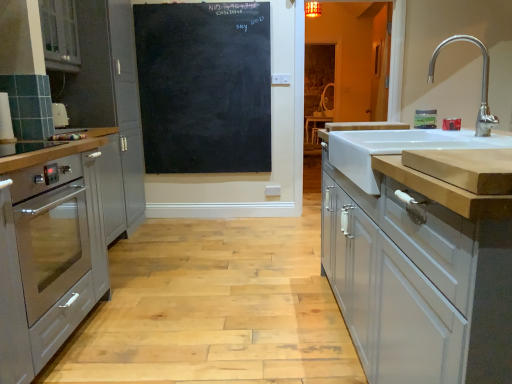
At what (x,y) coordinates should I click in order to perform the action: click on satin silver oven at left, the second cabinetry in the left-to-right sequence. Please return your answer as a coordinate pair (x, y). Looking at the image, I should click on (109, 104).

Is white glossy cabinet at right, positioned as the fourth cabinetry in left-to-right order, placed right next to white ceramic sink at right?

white glossy cabinet at right, positioned as the fourth cabinetry in left-to-right order, and white ceramic sink at right are clearly separated.

Consider the image. How much distance is there between white glossy cabinet at right, the 1th cabinetry viewed from the right, and white ceramic sink at right?

The distance of white glossy cabinet at right, the 1th cabinetry viewed from the right, from white ceramic sink at right is 23.52 centimeters.

Between white glossy cabinet at right, positioned as the fourth cabinetry in left-to-right order, and white ceramic sink at right, which one has smaller size?

Smaller between the two is white ceramic sink at right.

Is white glossy cabinet at right, the 1th cabinetry viewed from the right, situated inside white ceramic sink at right or outside?

white glossy cabinet at right, the 1th cabinetry viewed from the right, is spatially situated outside white ceramic sink at right.

Does white glossy cabinet at right, the 1th cabinetry viewed from the right, have a greater height compared to stainless steel oven at left?

Indeed, white glossy cabinet at right, the 1th cabinetry viewed from the right, has a greater height compared to stainless steel oven at left.

Could you measure the distance between white glossy cabinet at right, positioned as the fourth cabinetry in left-to-right order, and stainless steel oven at left?

They are 1.30 meters apart.

From a real-world perspective, is white glossy cabinet at right, the 1th cabinetry viewed from the right, positioned above or below stainless steel oven at left?

In terms of real-world spatial position, white glossy cabinet at right, the 1th cabinetry viewed from the right, is below stainless steel oven at left.

This screenshot has height=384, width=512. I want to click on the 1st cabinetry located beneath the stainless steel oven at left (from a real-world perspective), so click(417, 260).

From a real-world perspective, does satin silver oven at left, placed as the second cabinetry when sorted from right to left, stand above stainless steel oven at left?

Incorrect, from a real-world perspective, satin silver oven at left, placed as the second cabinetry when sorted from right to left, is lower than stainless steel oven at left.

Is satin silver oven at left, placed as the second cabinetry when sorted from right to left, to the right of stainless steel oven at left from the viewer's perspective?

In fact, satin silver oven at left, placed as the second cabinetry when sorted from right to left, is to the left of stainless steel oven at left.

Is satin silver oven at left, which is the third cabinetry in left-to-right order, inside or outside of stainless steel oven at left?

satin silver oven at left, which is the third cabinetry in left-to-right order, exists outside the volume of stainless steel oven at left.

Is green matte jar at upper right in contact with satin silver oven at left, which is the third cabinetry in left-to-right order?

green matte jar at upper right and satin silver oven at left, which is the third cabinetry in left-to-right order, are not in contact.

Locate an element on the screen. appliance that appears above the satin silver oven at left, which is the third cabinetry in left-to-right order (from the image's perspective) is located at coordinates (425, 119).

How many degrees apart are the facing directions of green matte jar at upper right and satin silver oven at left, placed as the second cabinetry when sorted from right to left?

The facing directions of green matte jar at upper right and satin silver oven at left, placed as the second cabinetry when sorted from right to left, are 0.805 degrees apart.

Which object is thinner, green matte jar at upper right or satin silver oven at left, which is the third cabinetry in left-to-right order?

green matte jar at upper right is thinner.

Considering the points (81, 91) and (138, 144), which point is behind, point (81, 91) or point (138, 144)?

The point (138, 144) is farther from the camera.

How different are the orientations of satin silver oven at left, the second cabinetry in the left-to-right sequence, and satin silver oven at left, placed as the second cabinetry when sorted from right to left, in degrees?

satin silver oven at left, the second cabinetry in the left-to-right sequence, and satin silver oven at left, placed as the second cabinetry when sorted from right to left, are facing 0.941 degrees away from each other.

Is satin silver oven at left, arranged as the 3th cabinetry when viewed from the right, not near satin silver oven at left, which is the third cabinetry in left-to-right order?

No.

From a real-world perspective, which object rests below the other?

satin silver oven at left, placed as the second cabinetry when sorted from right to left.

Is point (356, 283) closer to viewer compared to point (131, 209)?

Yes.

Is white glossy cabinet at right, the 1th cabinetry viewed from the right, oriented towards satin silver oven at left, arranged as the 3th cabinetry when viewed from the right?

No, white glossy cabinet at right, the 1th cabinetry viewed from the right, does not turn towards satin silver oven at left, arranged as the 3th cabinetry when viewed from the right.

How far apart are white glossy cabinet at right, the 1th cabinetry viewed from the right, and satin silver oven at left, the second cabinetry in the left-to-right sequence?

white glossy cabinet at right, the 1th cabinetry viewed from the right, and satin silver oven at left, the second cabinetry in the left-to-right sequence, are 6.73 feet apart.

Based on their sizes in the image, would you say white glossy cabinet at right, the 1th cabinetry viewed from the right, is bigger or smaller than satin silver oven at left, the second cabinetry in the left-to-right sequence?

white glossy cabinet at right, the 1th cabinetry viewed from the right, is bigger than satin silver oven at left, the second cabinetry in the left-to-right sequence.

From a real-world perspective, is satin silver oven at left, which is the third cabinetry in left-to-right order, positioned over satin silver oven at left, the second cabinetry in the left-to-right sequence, based on gravity?

No, from a real-world perspective, satin silver oven at left, which is the third cabinetry in left-to-right order, is not above satin silver oven at left, the second cabinetry in the left-to-right sequence.

Is satin silver oven at left, placed as the second cabinetry when sorted from right to left, with satin silver oven at left, arranged as the 3th cabinetry when viewed from the right?

Indeed, satin silver oven at left, placed as the second cabinetry when sorted from right to left, and satin silver oven at left, arranged as the 3th cabinetry when viewed from the right, are beside each other and touching.

From the image's perspective, between satin silver oven at left, placed as the second cabinetry when sorted from right to left, and satin silver oven at left, the second cabinetry in the left-to-right sequence, who is located below?

satin silver oven at left, placed as the second cabinetry when sorted from right to left.

Looking at this image, is satin silver oven at left, which is the third cabinetry in left-to-right order, spatially inside satin silver oven at left, arranged as the 3th cabinetry when viewed from the right, or outside of it?

satin silver oven at left, which is the third cabinetry in left-to-right order, is not inside satin silver oven at left, arranged as the 3th cabinetry when viewed from the right, it's outside.

Locate an element on the screen. This screenshot has height=384, width=512. cabinetry that is the 2nd one below the white ceramic sink at right (from a real-world perspective) is located at coordinates (417, 260).

From the image's perspective, count 1st cabinetrys downward from the stainless steel oven at left and point to it. Please provide its 2D coordinates.

[(417, 260)]

Based on their spatial positions, is white glossy cabinet at upper left, marked as the first cabinetry in a left-to-right arrangement, or satin silver oven at left, which is the third cabinetry in left-to-right order, further from black chalkboard at center?

Answer: Based on the image, white glossy cabinet at upper left, marked as the first cabinetry in a left-to-right arrangement, appears to be further to black chalkboard at center.

From the image, which object appears to be farther from white glossy cabinet at right, positioned as the fourth cabinetry in left-to-right order, stainless steel oven at left or white ceramic sink at right?

Based on the image, stainless steel oven at left appears to be further to white glossy cabinet at right, positioned as the fourth cabinetry in left-to-right order.

From the image, which object appears to be nearer to stainless steel oven at left, white ceramic sink at right or white glossy cabinet at right, positioned as the fourth cabinetry in left-to-right order?

white glossy cabinet at right, positioned as the fourth cabinetry in left-to-right order, is closer to stainless steel oven at left.

Which object lies further to the anchor point satin silver oven at left, which is the third cabinetry in left-to-right order, black chalkboard at center or stainless steel oven at left?

The object further to satin silver oven at left, which is the third cabinetry in left-to-right order, is stainless steel oven at left.

Looking at this image, considering their positions, is green matte jar at upper right positioned further to satin silver oven at left, which is the third cabinetry in left-to-right order, than black chalkboard at center?

green matte jar at upper right is further to satin silver oven at left, which is the third cabinetry in left-to-right order.

Considering their positions, is green matte jar at upper right positioned closer to white glossy cabinet at upper left, the 4th cabinetry from the right, than satin silver oven at left, the second cabinetry in the left-to-right sequence?

Among the two, satin silver oven at left, the second cabinetry in the left-to-right sequence, is located nearer to white glossy cabinet at upper left, the 4th cabinetry from the right.

In the scene shown: Based on their spatial positions, is white glossy cabinet at right, the 1th cabinetry viewed from the right, or satin silver oven at left, which is the third cabinetry in left-to-right order, further from black chalkboard at center?

Among the two, white glossy cabinet at right, the 1th cabinetry viewed from the right, is located further to black chalkboard at center.

Considering their positions, is white glossy cabinet at upper left, marked as the first cabinetry in a left-to-right arrangement, positioned closer to white ceramic sink at right than black chalkboard at center?

Based on the image, white glossy cabinet at upper left, marked as the first cabinetry in a left-to-right arrangement, appears to be nearer to white ceramic sink at right.

At what (x,y) coordinates should I click in order to perform the action: click on home appliance situated between white glossy cabinet at upper left, the 4th cabinetry from the right, and white ceramic sink at right from left to right. Please return your answer as a coordinate pair (x, y). The width and height of the screenshot is (512, 384). Looking at the image, I should click on (51, 230).

The image size is (512, 384). In order to click on home appliance between satin silver oven at left, placed as the second cabinetry when sorted from right to left, and black chalkboard at center from front to back in this screenshot , I will do `click(51, 230)`.

The width and height of the screenshot is (512, 384). Find the location of `sink located between stainless steel oven at left and white glossy cabinet at right, the 1th cabinetry viewed from the right, in the left-right direction`. sink located between stainless steel oven at left and white glossy cabinet at right, the 1th cabinetry viewed from the right, in the left-right direction is located at coordinates (394, 150).

Image resolution: width=512 pixels, height=384 pixels. What are the coordinates of `appliance positioned between white glossy cabinet at right, the 1th cabinetry viewed from the right, and black chalkboard at center from near to far` in the screenshot? It's located at (425, 119).